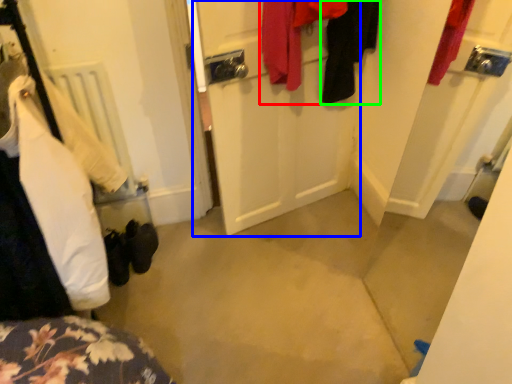
Question: Considering the real-world distances, which object is closest to clothing (highlighted by a red box)? door (highlighted by a blue box) or clothing (highlighted by a green box).

Choices:
 (A) door
 (B) clothing

Answer: (B)